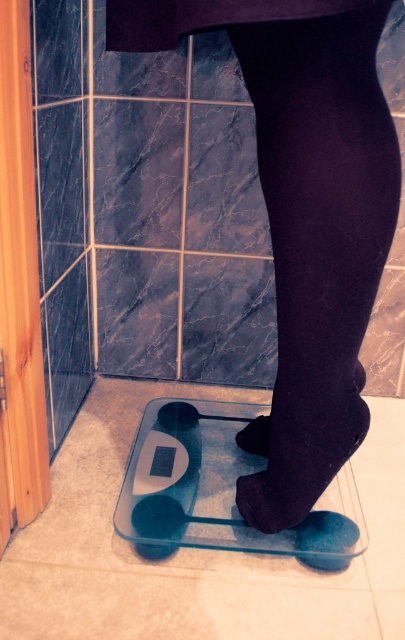
You are a contractor measuring the bathroom floor for new tiles. You have two points marked on the floor at coordinates point (319, 460) and point (249, 422). Which point is closer to you as you stand at the entrance of the bathroom?

Point (319, 460) is closer to the viewer than point (249, 422), so the point at (319, 460) is closer to you as you stand at the entrance of the bathroom.

You are a delivery person who needs to deliver a package to the bathroom scale in the image. The package requires a flat surface to place it. Is the area around the black velvet tights at lower center suitable for placing the package?

The black velvet tights at lower center are located at point (x=304, y=212), which is on the tiled floor. Since the tiles are flat, the area around the black velvet tights at lower center is suitable for placing the package.